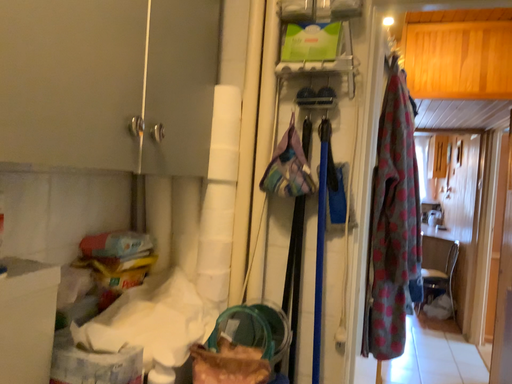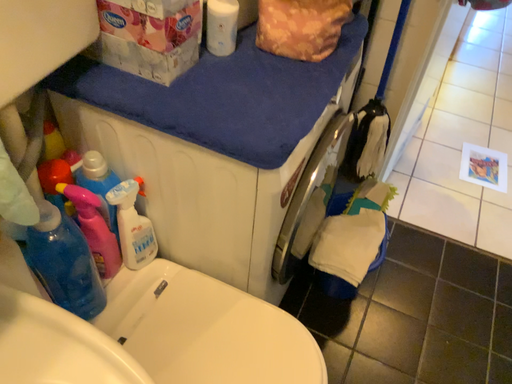
Question: How did the camera likely rotate when shooting the video?

Choices:
 (A) rotated right
 (B) rotated left

Answer: (B)